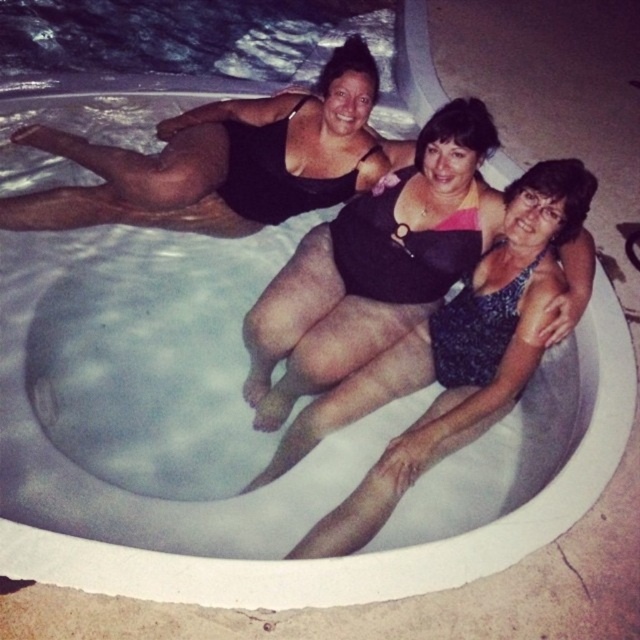
Question: Is black matte swimsuit at center thinner than black matte swimsuit at upper center?

Choices:
 (A) yes
 (B) no

Answer: (A)

Question: Is black matte swimsuit at center further to camera compared to black matte swimsuit at upper center?

Choices:
 (A) yes
 (B) no

Answer: (B)

Question: Among these objects, which one is farthest from the camera?

Choices:
 (A) black matte swimsuit at upper center
 (B) black matte swimsuit at center

Answer: (A)

Question: Is black matte swimsuit at center smaller than black matte swimsuit at upper center?

Choices:
 (A) no
 (B) yes

Answer: (B)

Question: Which point is closer to the camera?

Choices:
 (A) black matte swimsuit at center
 (B) black matte swimsuit at upper center

Answer: (A)

Question: Which of the following is the closest to the observer?

Choices:
 (A) black matte swimsuit at center
 (B) black matte swimsuit at upper center

Answer: (A)